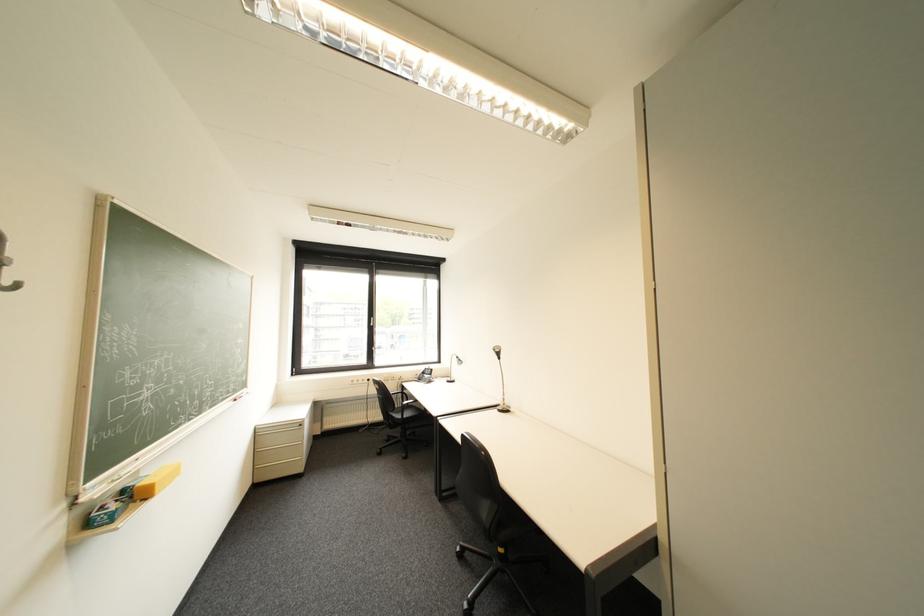
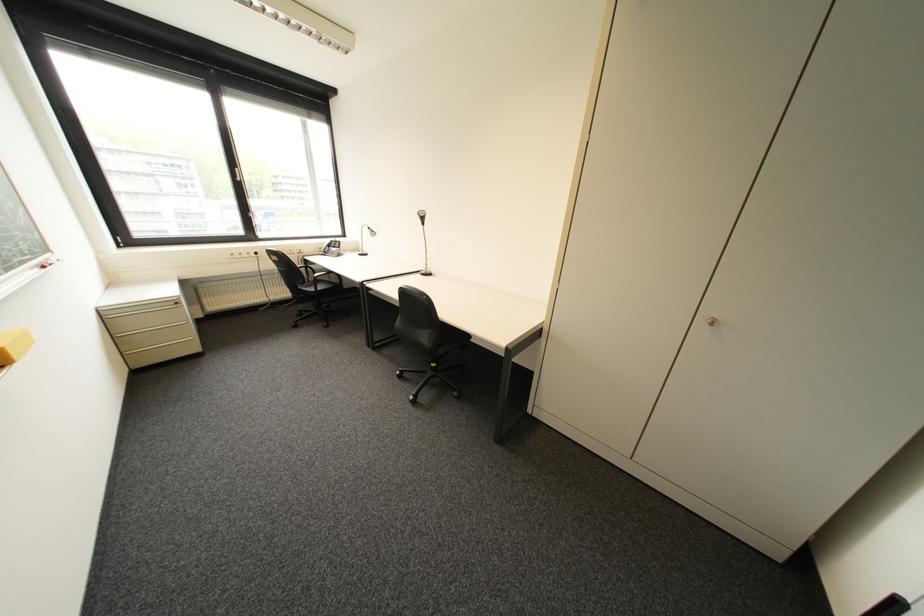
The point at (507, 408) is marked in the first image. Where is the corresponding point in the second image?

(432, 273)